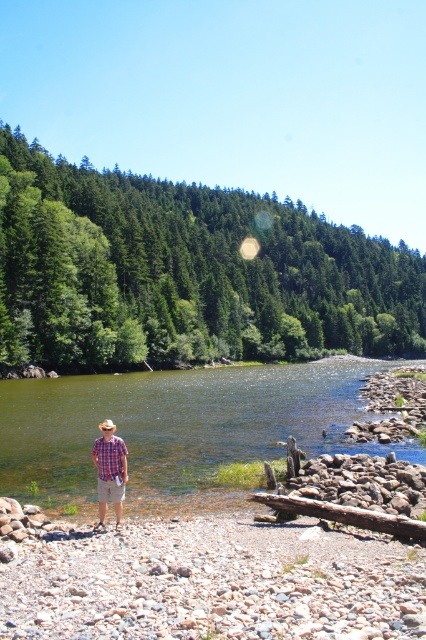
You are a hiker who wants to cross the river. You see the green smooth water at center and the plaid cotton shirt at center. Which object is located below the other?

The green smooth water at center is positioned under the plaid cotton shirt at center, so the water is below the shirt.

You are a photographer trying to capture the scene of the green smooth water at center and the plaid cotton shirt at center. Which object should you focus on first if you want to ensure both are in sharp focus?

You should focus on the plaid cotton shirt at center first because it is closer to you than the green smooth water at center, which is further away. By focusing on the closer object, you can ensure both are in focus using the depth of field.

Consider the image. You are standing at the point with coordinates point [120,477] and want to walk to the point with coordinates point [20,426]. Which direction should you face to walk towards your destination?

To walk from point [120,477] to point [20,426], you should face towards the northwest direction since point [20,426] is behind point [120,477].